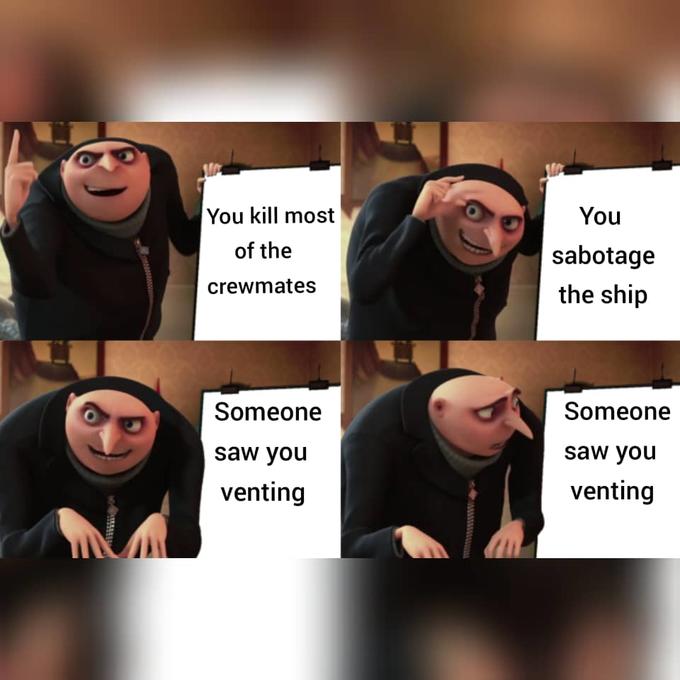
Locate an element on the screen. The width and height of the screenshot is (680, 680). wall is located at coordinates (517, 139).